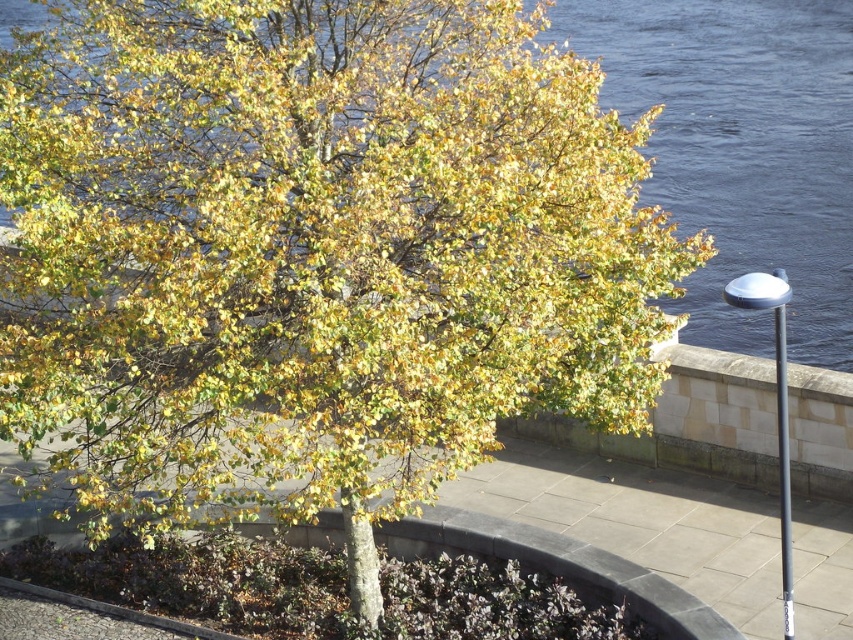
Question: Which point is farther to the camera?

Choices:
 (A) sleek metallic pole at right
 (B) gray concrete pavement at center

Answer: (B)

Question: Which of the following is the closest to the observer?

Choices:
 (A) (689, 588)
 (B) (756, 278)

Answer: (B)

Question: Is gray concrete pavement at center thinner than sleek metallic pole at right?

Choices:
 (A) yes
 (B) no

Answer: (B)

Question: Is gray concrete pavement at center smaller than sleek metallic pole at right?

Choices:
 (A) yes
 (B) no

Answer: (B)

Question: Does gray concrete pavement at center have a greater width compared to sleek metallic pole at right?

Choices:
 (A) no
 (B) yes

Answer: (B)